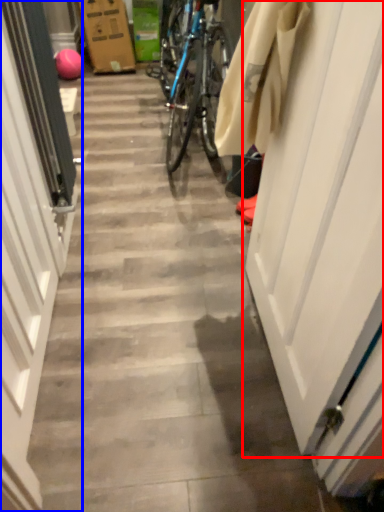
Question: Which point is closer to the camera, door (highlighted by a red box) or door (highlighted by a blue box)?

Choices:
 (A) door
 (B) door

Answer: (A)